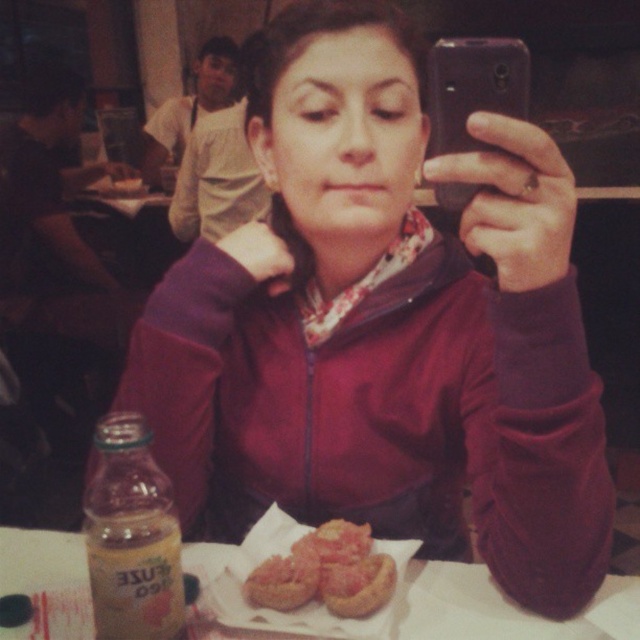
Which is behind, point (406, 589) or point (257, 586)?

Positioned behind is point (406, 589).

Locate an element on the screen. This screenshot has width=640, height=640. white paper plate at lower center is located at coordinates (472, 609).

Consider the image. Is golden brown bread at lower center below pinkish-brown bread at center?

Yes, golden brown bread at lower center is below pinkish-brown bread at center.

Is point (392, 560) positioned before point (260, 576)?

No, it is behind (260, 576).

Locate an element on the screen. The image size is (640, 640). golden brown bread at lower center is located at coordinates (356, 586).

Who is lower down, black plastic phone at upper center or golden crispy bread at center?

golden crispy bread at center

How distant is black plastic phone at upper center from golden crispy bread at center?

black plastic phone at upper center is 12.25 inches from golden crispy bread at center.

Describe the element at coordinates (474, 88) in the screenshot. The height and width of the screenshot is (640, 640). I see `black plastic phone at upper center` at that location.

This screenshot has width=640, height=640. I want to click on black plastic phone at upper center, so click(x=474, y=88).